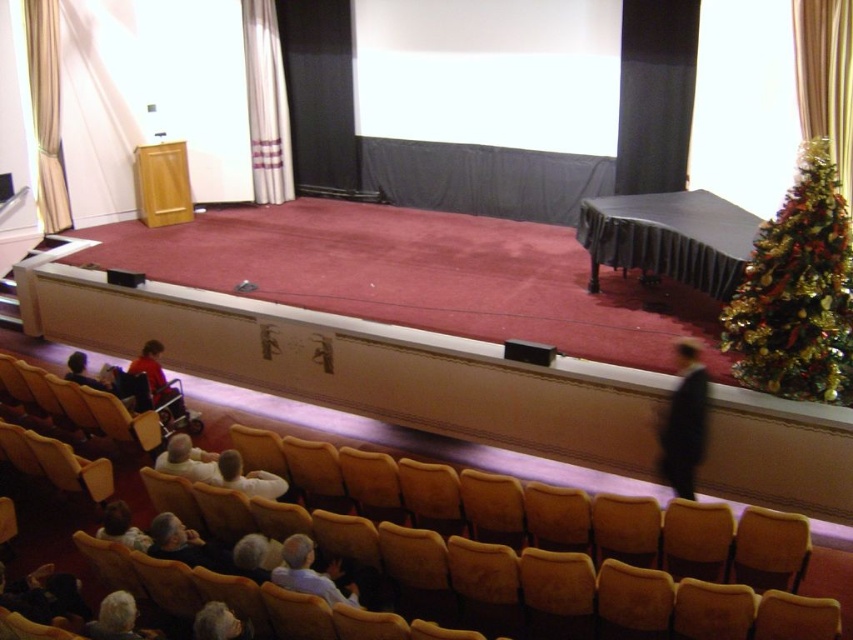
You are standing on the stage in the auditorium. You see two points marked on the stage floor. The first point is at position point (x=48, y=122) and the second point is at position point (x=160, y=342). Which point is closer to you?

→ Point point (x=48, y=122) is closer to you because it is further to the viewer than point point (x=160, y=342).

You are organizing a small event in the auditorium and need to place a large banner that requires a lot of space. Based on the scene, which object between the green shiny christmas tree at right and the white fabric curtain at upper center would be the better choice for hanging the banner?

The white fabric curtain at upper center would be the better choice for hanging the large banner since it occupies more space than the green shiny christmas tree at right, providing sufficient area for the banner.

You are an event planner setting up for a presentation. You need to ensure the matte red shirt at center is visible to the audience. Is the gold textured curtain at left blocking its view?

The gold textured curtain at left is positioned on the left side of the matte red shirt at center, so it will not block the view of the matte red shirt at center from the audience as it is to the left.